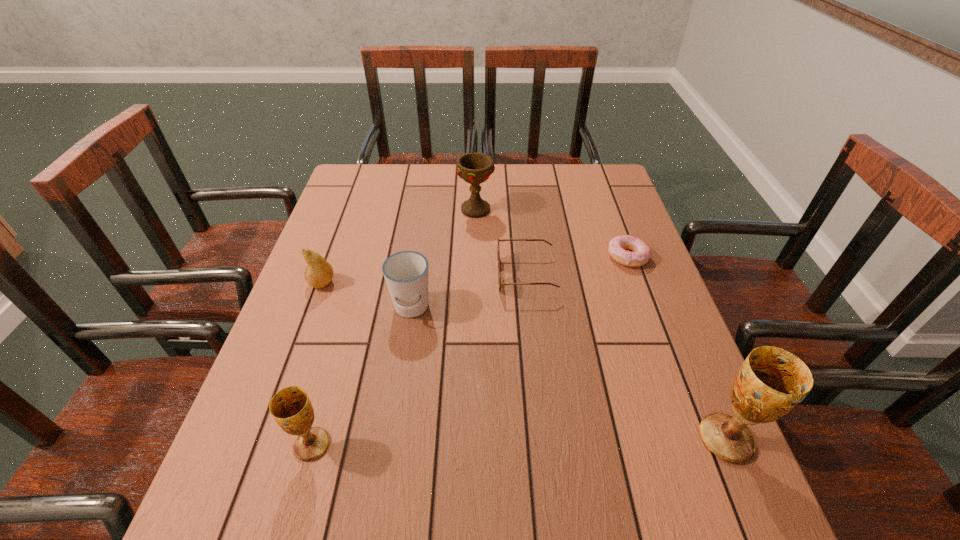
This screenshot has width=960, height=540. Identify the location of the leftmost chalice. (291, 408).

The image size is (960, 540). Identify the location of the tallest chalice. (772, 381).

Where is `the rightmost chalice`? the rightmost chalice is located at coordinates pos(772,381).

Locate an element on the screen. The height and width of the screenshot is (540, 960). the second chalice from left to right is located at coordinates (475, 168).

At what (x,y) coordinates should I click in order to perform the action: click on the fourth object from right to left. Please return your answer as a coordinate pair (x, y). Image resolution: width=960 pixels, height=540 pixels. Looking at the image, I should click on (475, 168).

Where is `the sixth tallest object`? The height and width of the screenshot is (540, 960). the sixth tallest object is located at coordinates (498, 252).

This screenshot has height=540, width=960. Find the location of `the third object from right to left`. the third object from right to left is located at coordinates (498, 252).

You are a GUI agent. You are given a task and a screenshot of the screen. Output one action in this format:
    pyautogui.click(x=<x>, y=<y>)
    Task: Click on the pear
    The image size is (960, 540).
    Given the screenshot: What is the action you would take?
    pyautogui.click(x=318, y=273)

Identify the location of doughnut. This screenshot has width=960, height=540. (641, 254).

What are the coordinates of `cup` in the screenshot? It's located at (406, 273).